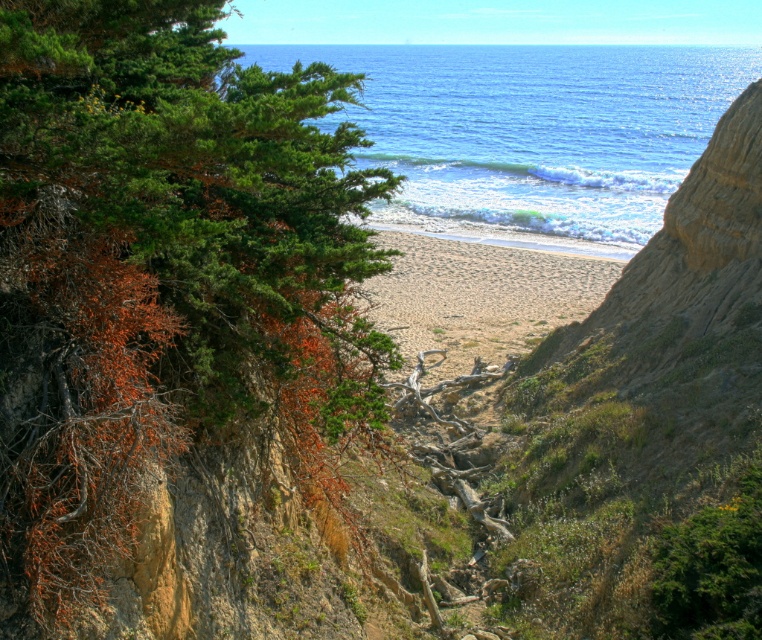
Question: Which of the following is the closest to the observer?

Choices:
 (A) pyautogui.click(x=511, y=109)
 (B) pyautogui.click(x=186, y=227)

Answer: (B)

Question: Is green leafy tree at left closer to camera compared to blue water at center?

Choices:
 (A) no
 (B) yes

Answer: (B)

Question: Is the position of green leafy tree at left less distant than that of blue water at center?

Choices:
 (A) no
 (B) yes

Answer: (B)

Question: In this image, where is green leafy tree at left located relative to blue water at center?

Choices:
 (A) above
 (B) below

Answer: (B)